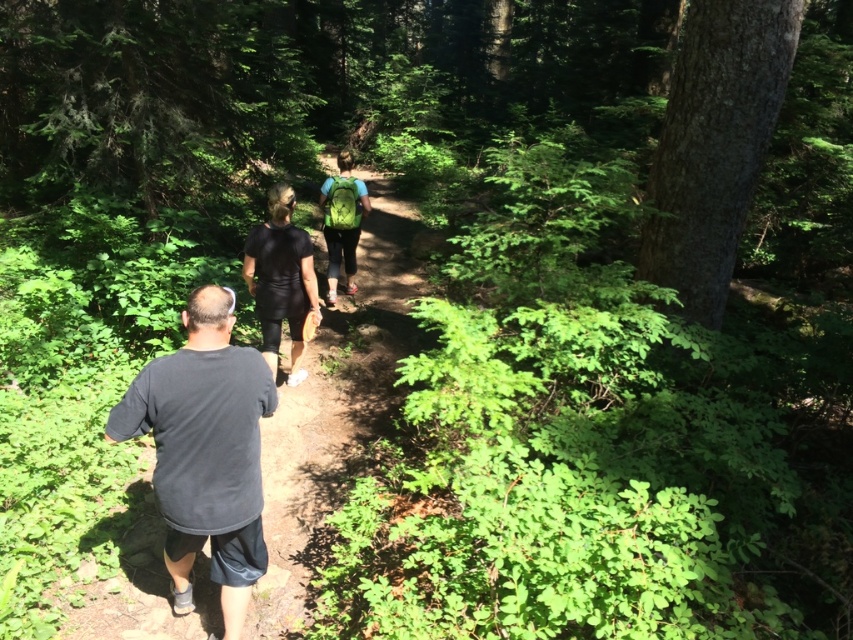
Question: Which point is farther to the camera?

Choices:
 (A) dark gray t-shirt at center
 (B) black fabric backpack at center

Answer: (B)

Question: Can you confirm if black fabric backpack at center is smaller than dark gray t-shirt at center?

Choices:
 (A) yes
 (B) no

Answer: (A)

Question: Does black fabric backpack at center have a lesser width compared to dark gray t-shirt at center?

Choices:
 (A) yes
 (B) no

Answer: (A)

Question: Is black fabric backpack at center positioned at the back of dark gray t-shirt at center?

Choices:
 (A) yes
 (B) no

Answer: (A)

Question: Which point is farther to the camera?

Choices:
 (A) (212, 288)
 (B) (128, 404)

Answer: (A)